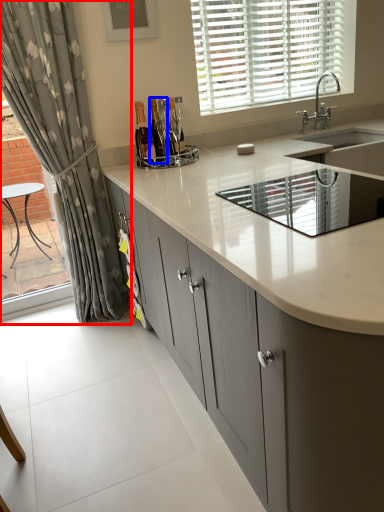
Question: Which object is further to the camera taking this photo, curtain (highlighted by a red box) or bottle (highlighted by a blue box)?

Choices:
 (A) curtain
 (B) bottle

Answer: (B)